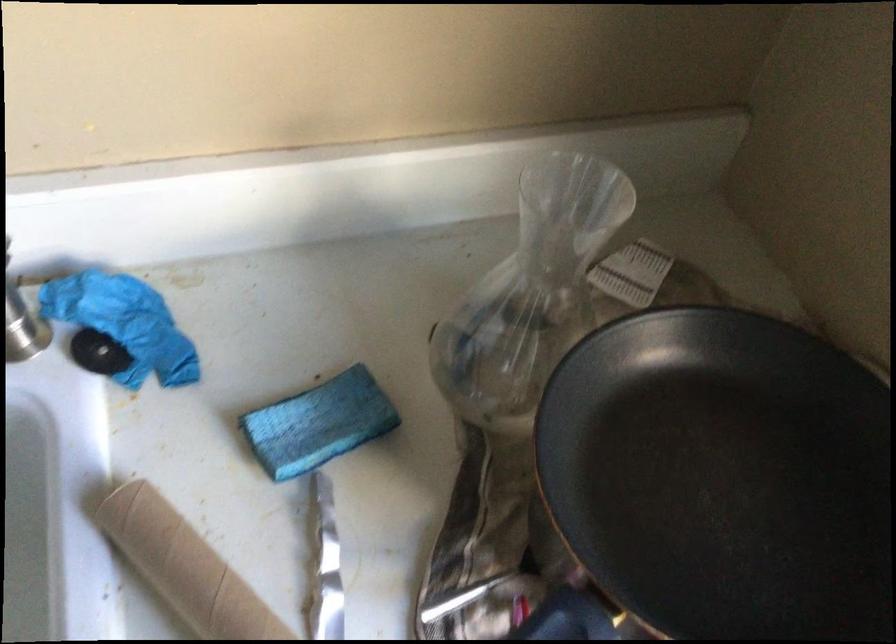
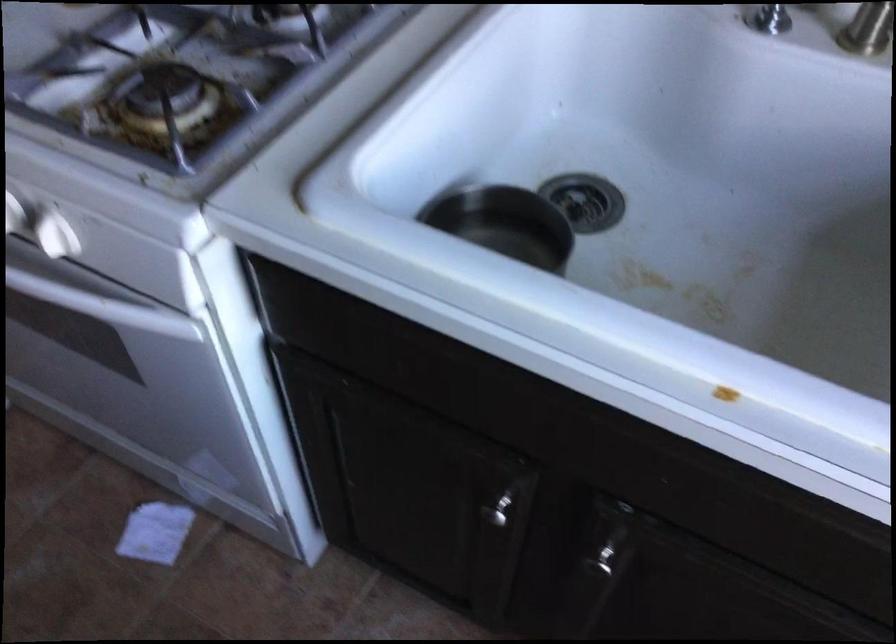
Question: The camera is either moving clockwise (left) or counter-clockwise (right) around the object. The first image is from the beginning of the video and the second image is from the end. Is the camera moving left or right when shooting the video?

Choices:
 (A) Left
 (B) Right

Answer: (B)